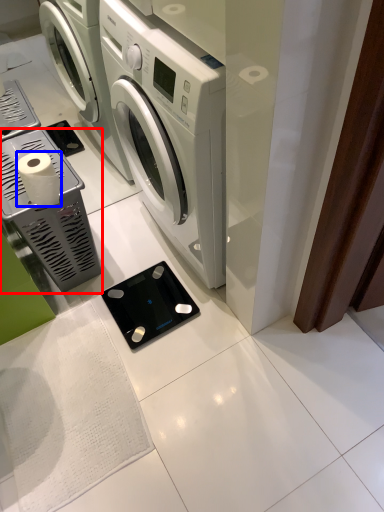
Question: Which point is closer to the camera, appliance (highlighted by a red box) or toilet paper (highlighted by a blue box)?

Choices:
 (A) appliance
 (B) toilet paper

Answer: (B)